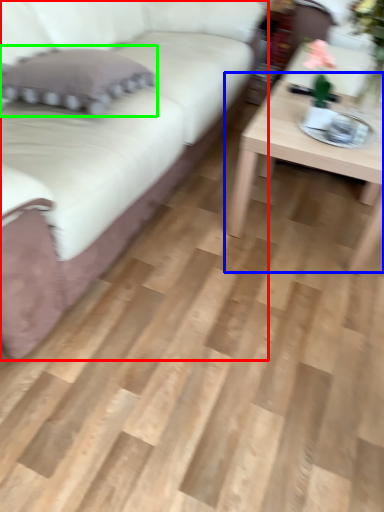
Question: Which object is the closest to the studio couch (highlighted by a red box)? Choose among these: coffee table (highlighted by a blue box) or pillow (highlighted by a green box).

Choices:
 (A) coffee table
 (B) pillow

Answer: (B)